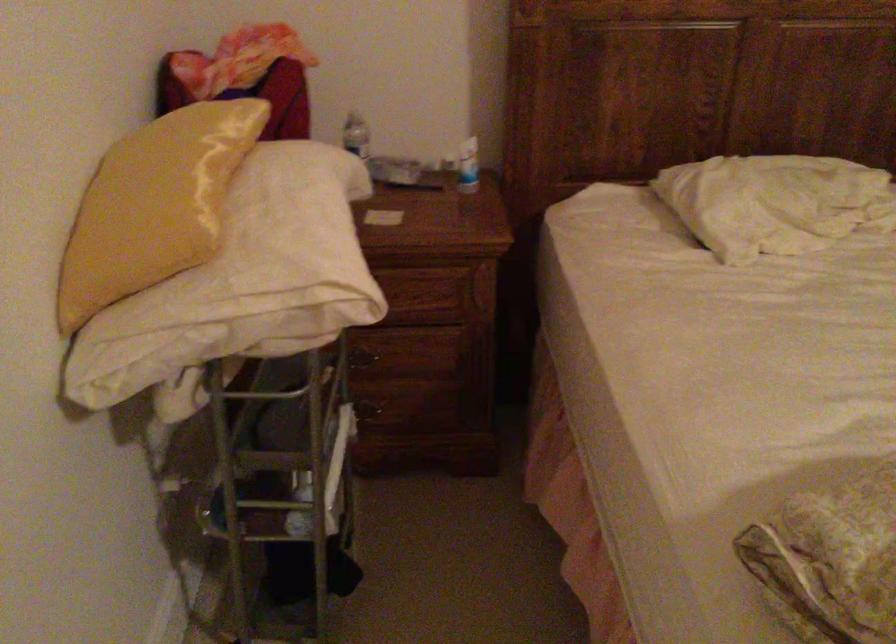
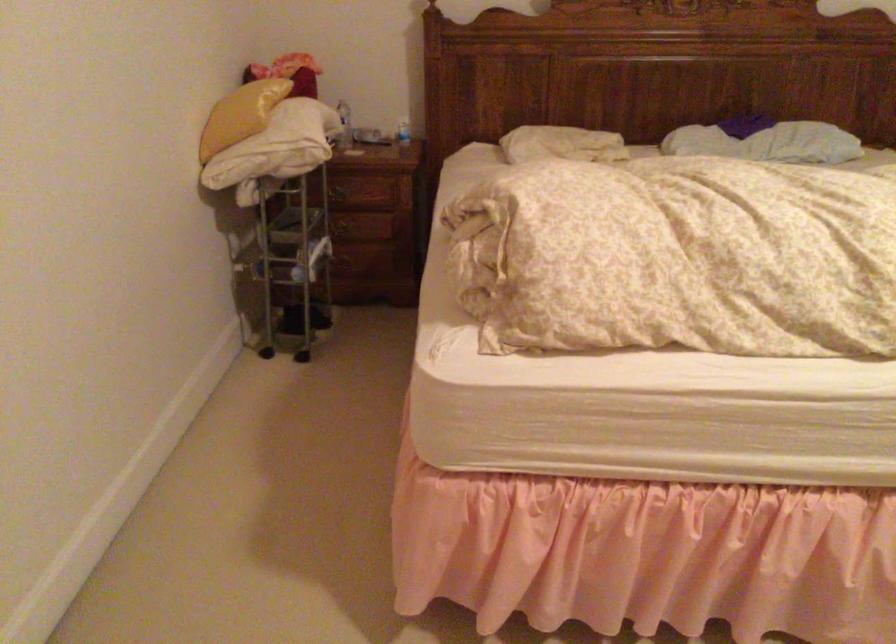
Locate, in the second image, the point that corresponds to the point at 148,218 in the first image.

(240, 115)